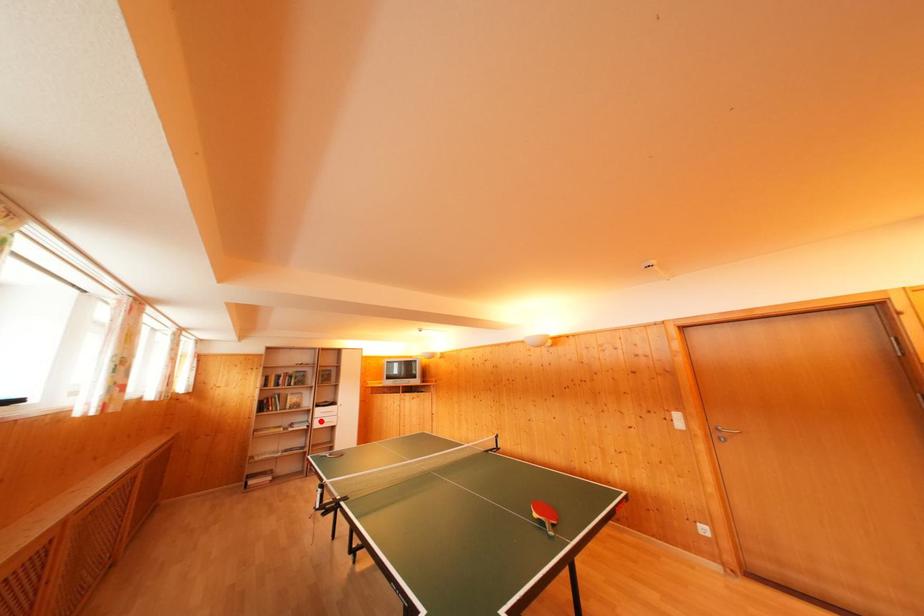
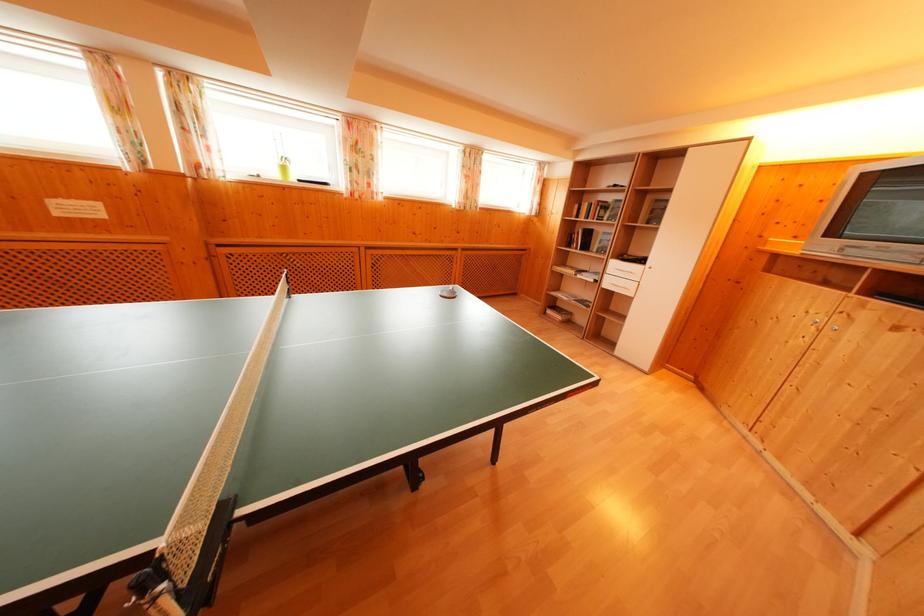
Question: I am providing you with two images of the same scene from different viewpoints. In image1, a red point is highlighted. Considering the same 3D point in image2, which of the following is correct?

Choices:
 (A) It is closer
 (B) It is farther

Answer: (A)